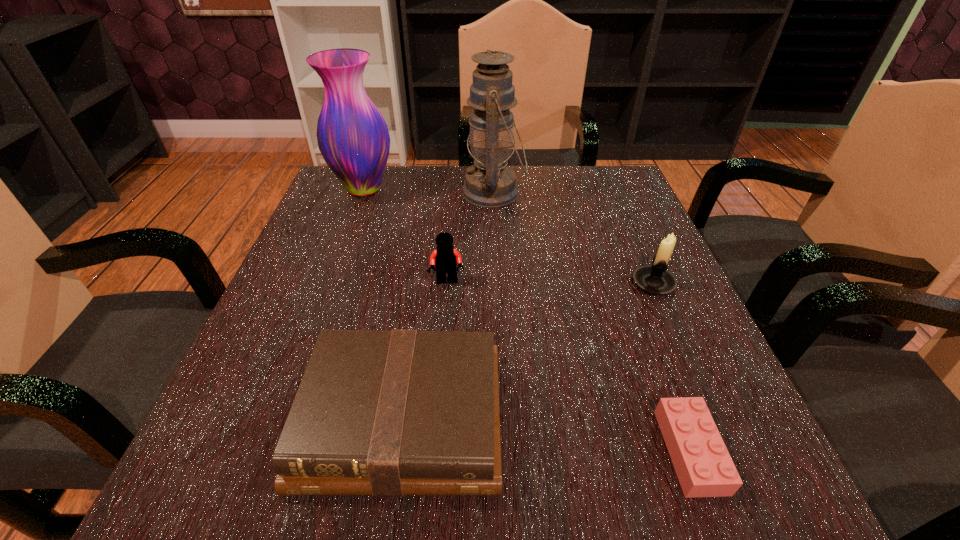
In the image, there is a desktop. At what (x,y) coordinates should I click in order to perform the action: click on free space at the near right corner. Please return your answer as a coordinate pair (x, y). This screenshot has height=540, width=960. Looking at the image, I should click on (780, 502).

Locate an element on the screen. free space between the vase and the farther Lego is located at coordinates (406, 235).

Where is `empty location between the oil lamp and the taller Lego`? Image resolution: width=960 pixels, height=540 pixels. empty location between the oil lamp and the taller Lego is located at coordinates (470, 237).

This screenshot has width=960, height=540. Identify the location of free area in between the nearer Lego and the oil lamp. pos(592,322).

You are a GUI agent. You are given a task and a screenshot of the screen. Output one action in this format:
    pyautogui.click(x=<x>, y=<y>)
    Task: Click on the vacant area between the oil lamp and the vase
    The width and height of the screenshot is (960, 540).
    Given the screenshot: What is the action you would take?
    pyautogui.click(x=429, y=190)

At what (x,y) coordinates should I click in order to perform the action: click on vacant space in between the left Lego and the candle holder. Please return your answer as a coordinate pair (x, y). Looking at the image, I should click on (551, 282).

Where is `free space between the fourth shortest object and the vase`? Image resolution: width=960 pixels, height=540 pixels. free space between the fourth shortest object and the vase is located at coordinates (509, 236).

What are the coordinates of `free space between the vase and the second shortest object` in the screenshot? It's located at (383, 304).

In order to click on empty location between the shortest object and the Bible in this screenshot , I will do `click(546, 435)`.

At what (x,y) coordinates should I click in order to perform the action: click on free point between the fourth tallest object and the nearer Lego. Please return your answer as a coordinate pair (x, y). The image size is (960, 540). Looking at the image, I should click on (569, 366).